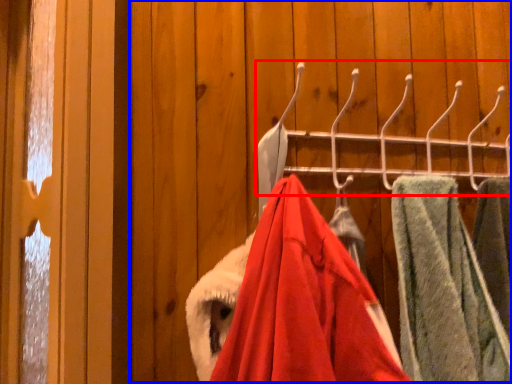
Question: Which of the following is the farthest to the observer, closet (highlighted by a red box) or closet (highlighted by a blue box)?

Choices:
 (A) closet
 (B) closet

Answer: (A)